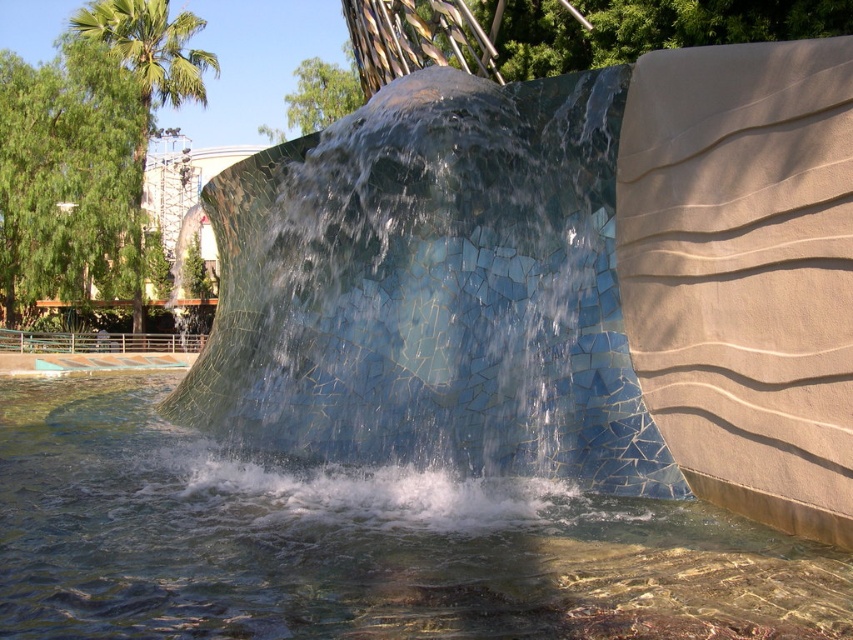
Question: Estimate the real-world distances between objects in this image. Which object is closer to the blue mosaic wall at center?

Choices:
 (A) translucent glass water at center
 (B) green leafy palm tree at upper left

Answer: (A)

Question: Observing the image, what is the correct spatial positioning of blue mosaic wall at center in reference to translucent glass water at center?

Choices:
 (A) right
 (B) left

Answer: (A)

Question: Which object appears farthest from the camera in this image?

Choices:
 (A) translucent glass water at center
 (B) green leafy palm tree at upper left

Answer: (B)

Question: Does blue mosaic wall at center have a greater width compared to green leafy palm tree at upper left?

Choices:
 (A) yes
 (B) no

Answer: (B)

Question: Considering the relative positions of blue mosaic wall at center and green leafy palm tree at upper left in the image provided, where is blue mosaic wall at center located with respect to green leafy palm tree at upper left?

Choices:
 (A) below
 (B) above

Answer: (A)

Question: Which point is closer to the camera?

Choices:
 (A) (4, 406)
 (B) (434, 220)

Answer: (B)